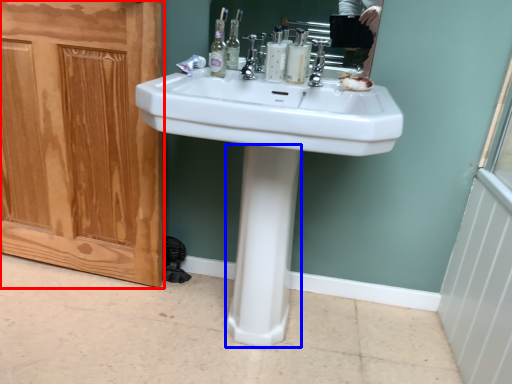
Question: Which of the following is the closest to the observer, screen door (highlighted by a red box) or bidet (highlighted by a blue box)?

Choices:
 (A) screen door
 (B) bidet

Answer: (B)